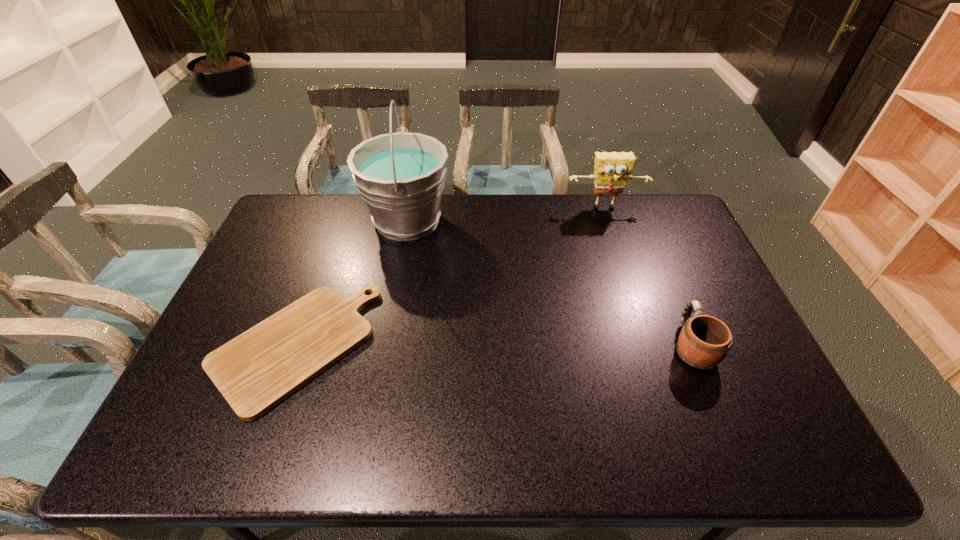
Where is `free space that is in between the mug and the chopping board`? The height and width of the screenshot is (540, 960). free space that is in between the mug and the chopping board is located at coordinates (492, 346).

At what (x,y) coordinates should I click in order to perform the action: click on unoccupied position between the bucket and the third shortest object. Please return your answer as a coordinate pair (x, y). The image size is (960, 540). Looking at the image, I should click on (507, 215).

This screenshot has height=540, width=960. I want to click on unoccupied position between the chopping board and the mug, so click(492, 346).

You are a GUI agent. You are given a task and a screenshot of the screen. Output one action in this format:
    pyautogui.click(x=<x>, y=<y>)
    Task: Click on the vacant space in between the bucket and the third shortest object
    This screenshot has height=540, width=960.
    Given the screenshot: What is the action you would take?
    pyautogui.click(x=507, y=215)

At what (x,y) coordinates should I click in order to perform the action: click on free space between the mug and the bucket. Please return your answer as a coordinate pair (x, y). Looking at the image, I should click on (550, 283).

Locate an element on the screen. Image resolution: width=960 pixels, height=540 pixels. free space between the second tallest object and the shortest object is located at coordinates (449, 278).

Where is `empty location between the shortest object and the second shortest object`? empty location between the shortest object and the second shortest object is located at coordinates (492, 346).

Where is `vacant space that's between the mug and the shortest object`? The width and height of the screenshot is (960, 540). vacant space that's between the mug and the shortest object is located at coordinates (492, 346).

Where is `vacant space that's between the chopping board and the second shortest object`? This screenshot has height=540, width=960. vacant space that's between the chopping board and the second shortest object is located at coordinates (492, 346).

I want to click on object that stands as the closest to the second tallest object, so click(400, 176).